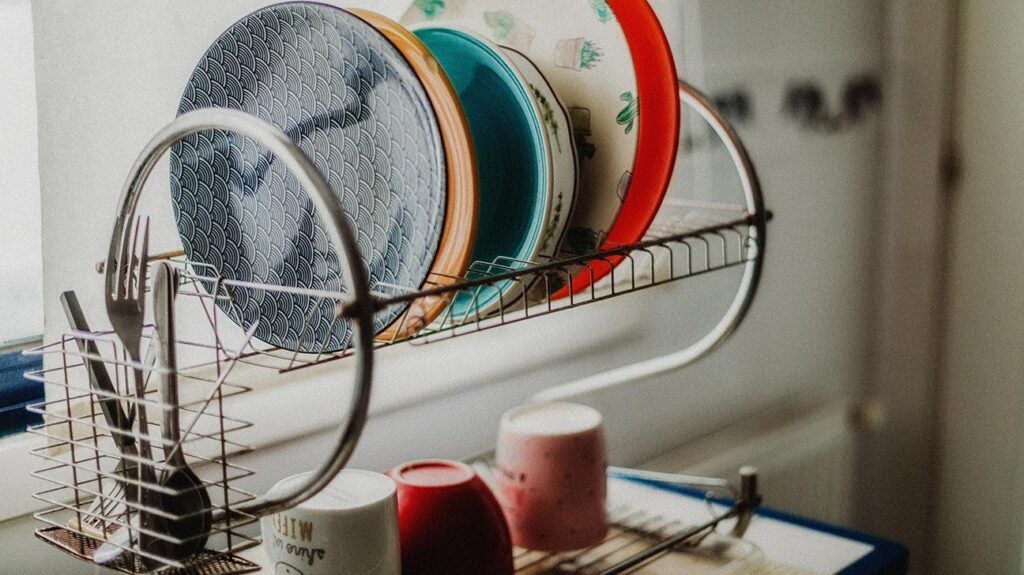
What are the coordinates of `flatware` in the screenshot? It's located at (69, 316), (116, 316), (162, 296), (146, 352), (171, 316).